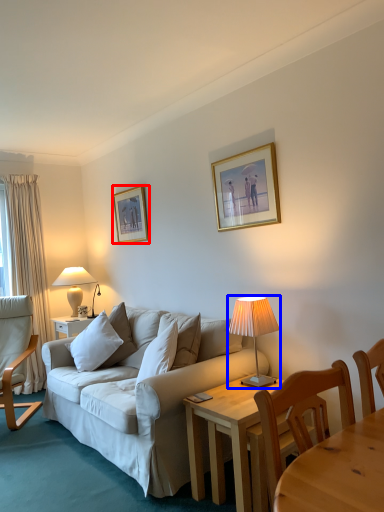
Question: Which object is closer to the camera taking this photo, picture frame (highlighted by a red box) or lamp (highlighted by a blue box)?

Choices:
 (A) picture frame
 (B) lamp

Answer: (B)